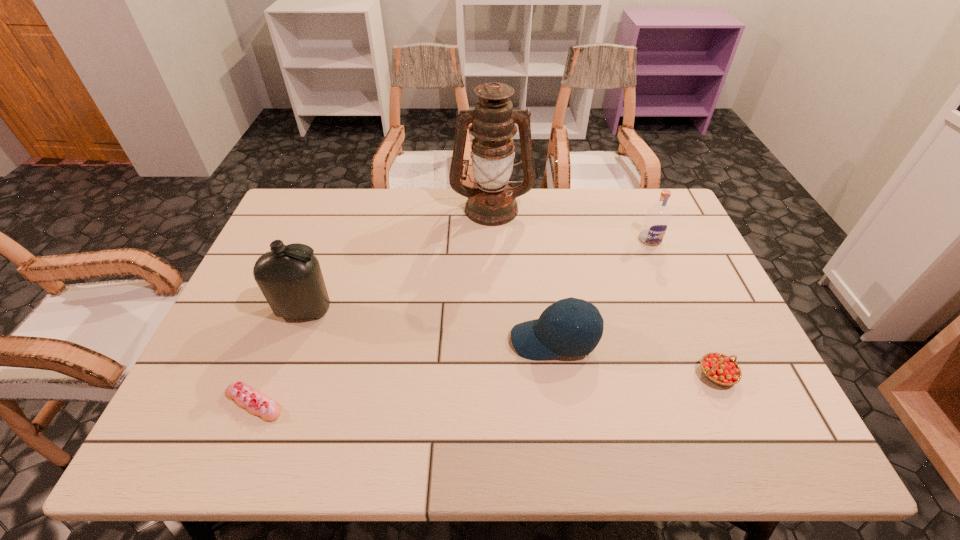
Where is `vacant area that lies between the lantern and the baseball cap`? vacant area that lies between the lantern and the baseball cap is located at coordinates [523, 274].

I want to click on free point between the baseball cap and the bottle, so click(429, 326).

Locate an element on the screen. free space that is in between the shortest object and the fourth tallest object is located at coordinates (404, 372).

In order to click on vacant space that's between the lantern and the vodka in this screenshot , I will do `click(571, 224)`.

Find the location of a particular element. Image resolution: width=960 pixels, height=540 pixels. free space between the second shortest object and the baseball cap is located at coordinates (636, 357).

Locate an element on the screen. vacant space that's between the second tallest object and the second shortest object is located at coordinates (511, 343).

Find the location of `empty location between the shortest object and the second tallest object`. empty location between the shortest object and the second tallest object is located at coordinates (279, 356).

Where is `vacant space that's between the bottle and the vodka`? vacant space that's between the bottle and the vodka is located at coordinates (477, 275).

This screenshot has height=540, width=960. Find the location of `vacant point located between the third shortest object and the bottle`. vacant point located between the third shortest object and the bottle is located at coordinates (429, 326).

Identify which object is located as the fourth nearest to the tallest object. Please provide its 2D coordinates. Your answer should be formatted as a tuple, i.e. [(x, y)], where the tuple contains the x and y coordinates of a point satisfying the conditions above.

[(720, 369)]